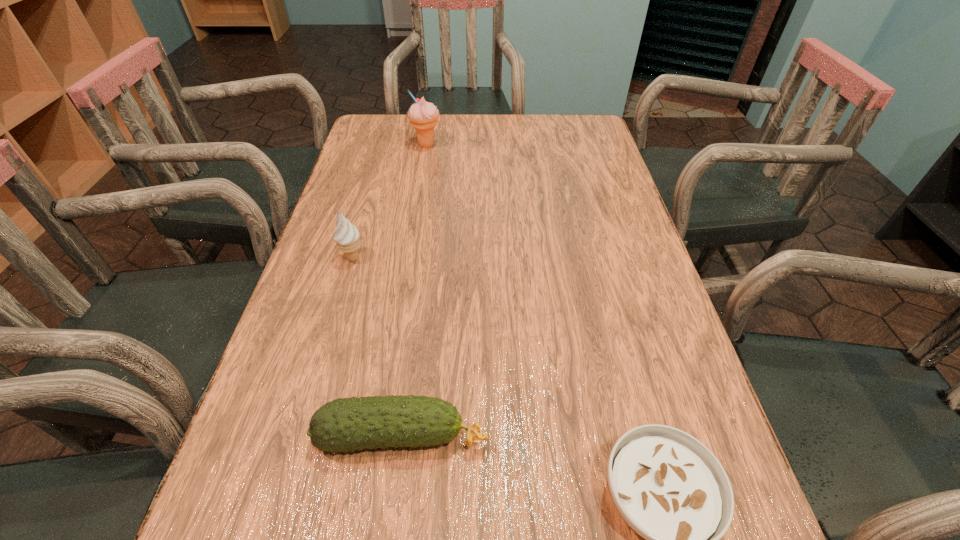
You are a GUI agent. You are given a task and a screenshot of the screen. Output one action in this format:
    pyautogui.click(x=<x>, y=<y>)
    Task: Click on the second closest object to the soup bowl
    The height and width of the screenshot is (540, 960).
    Given the screenshot: What is the action you would take?
    pyautogui.click(x=347, y=235)